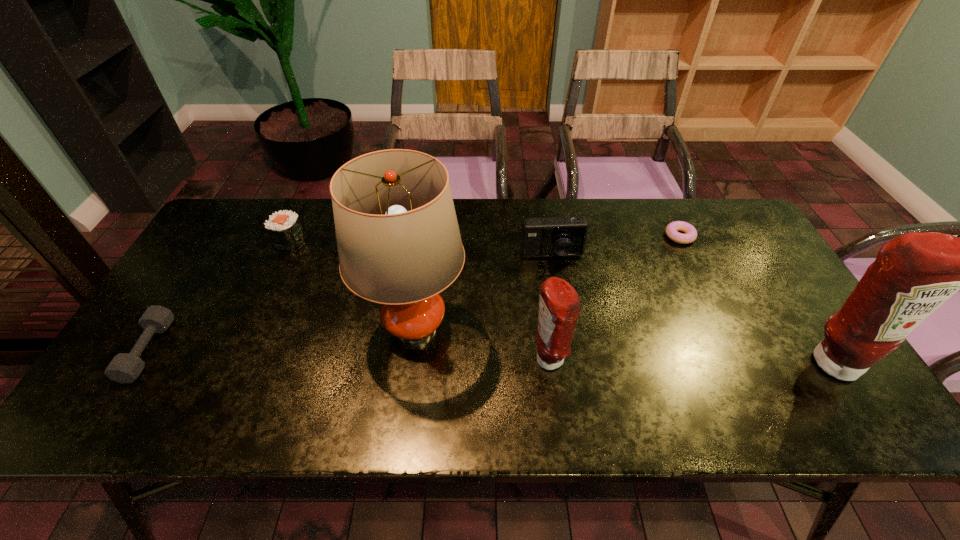
Please point a spot on the left to add another condiment. Please provide its 2D coordinates. Your answer should be formatted as a tuple, i.e. [(x, y)], where the tuple contains the x and y coordinates of a point satisfying the conditions above.

[(266, 358)]